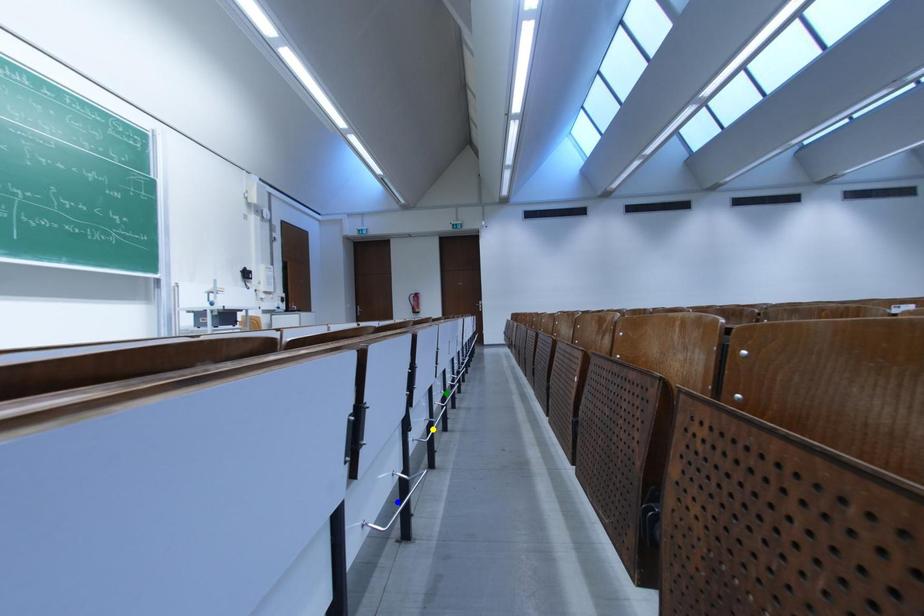
Order these from nearest to farthest:
- blue point
- green point
- yellow point

1. blue point
2. yellow point
3. green point